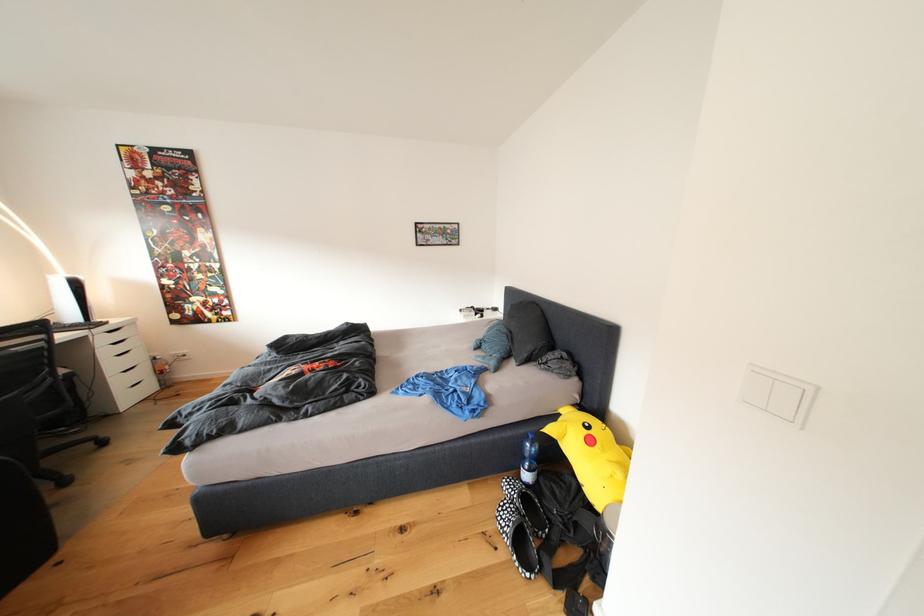
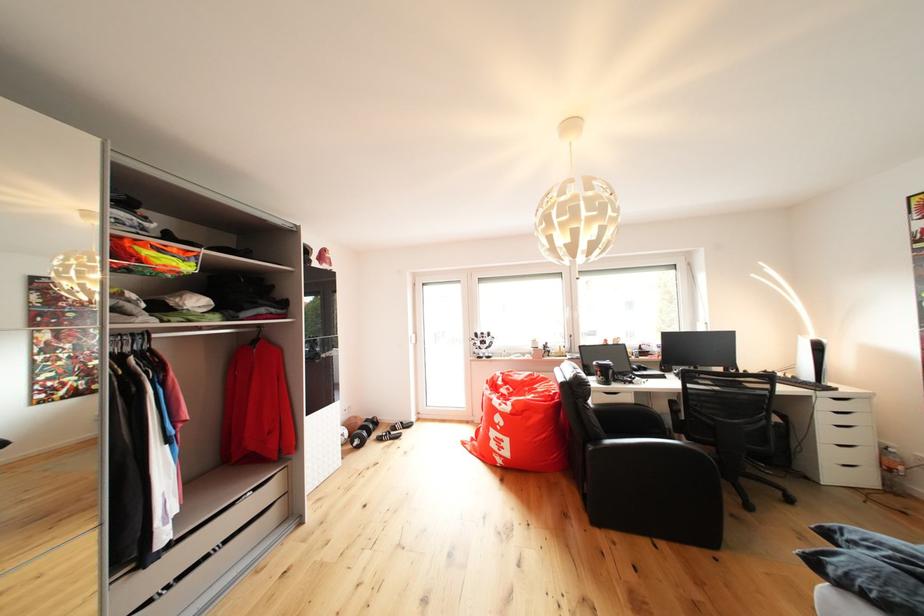
Where in the second image is the point corresponding to pixel 125 326 from the first image?

(855, 395)